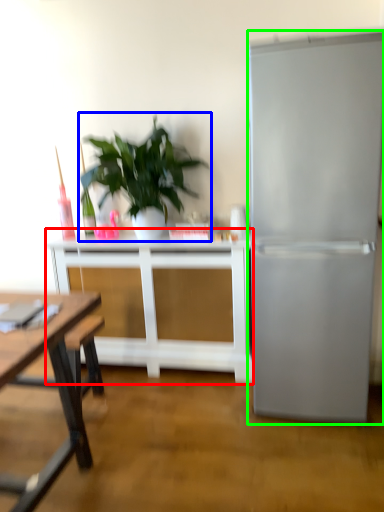
Question: Estimate the real-world distances between objects in this image. Which object is closer to table (highlighted by a red box), houseplant (highlighted by a blue box) or refrigerator (highlighted by a green box)?

Choices:
 (A) houseplant
 (B) refrigerator

Answer: (A)